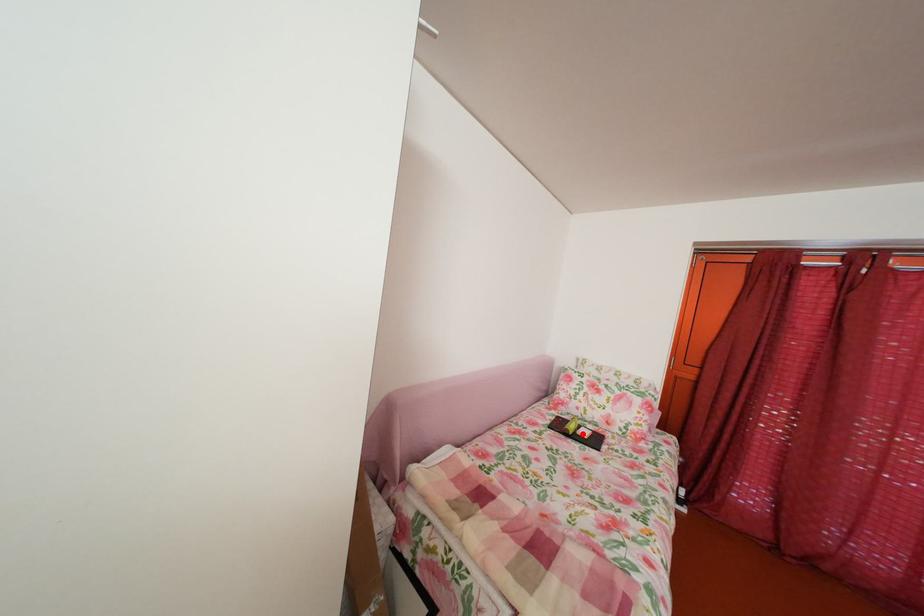
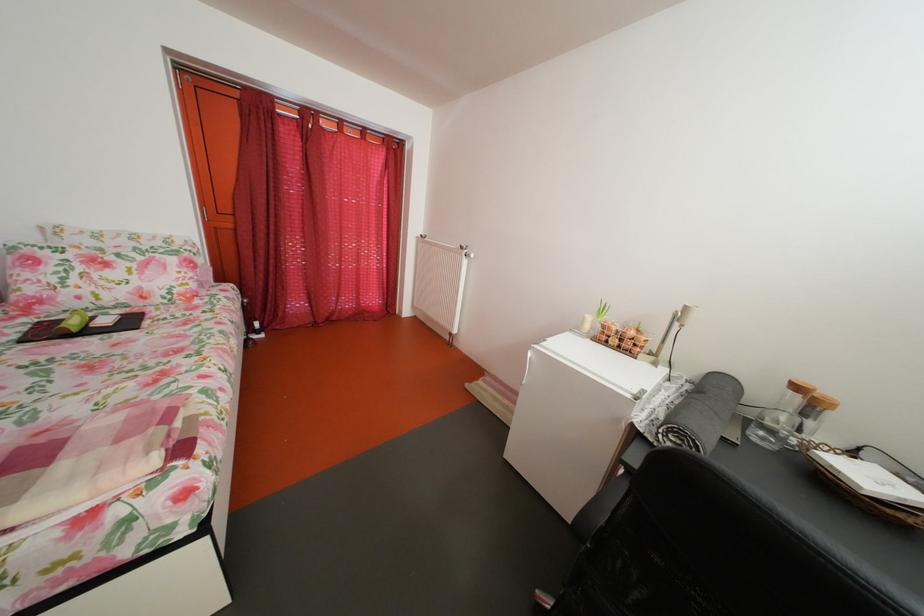
The point at the highlighted location is marked in the first image. Where is the corresponding point in the second image?

(83, 330)